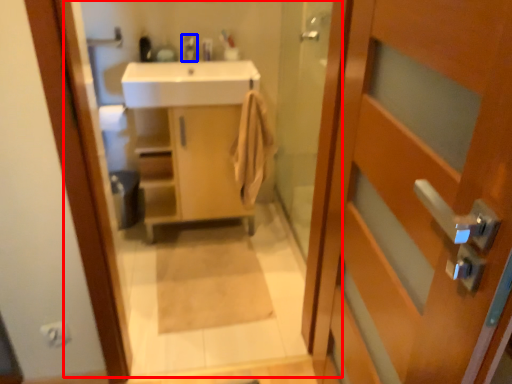
Question: Which of the following is the closest to the observer, mirror (highlighted by a red box) or tap (highlighted by a blue box)?

Choices:
 (A) mirror
 (B) tap

Answer: (A)